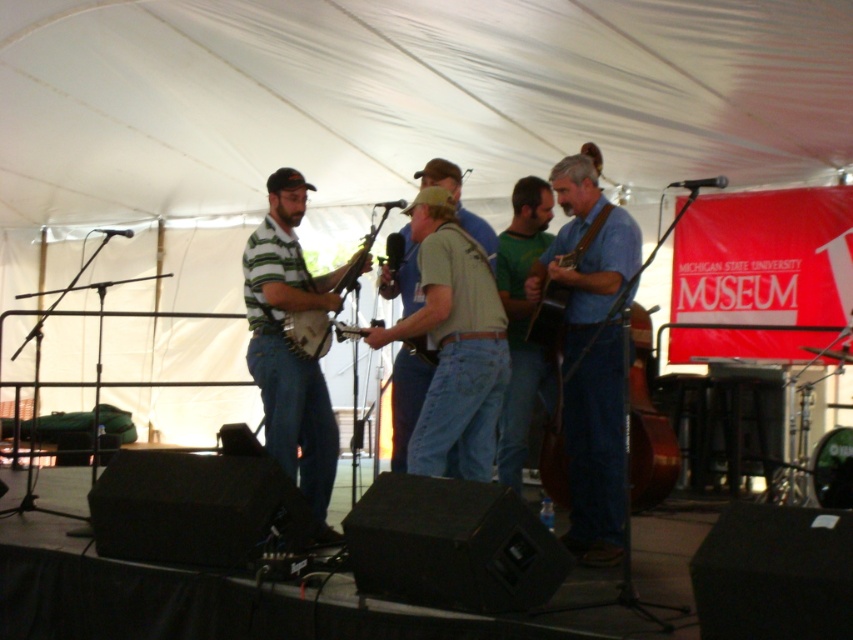
Question: Which object appears farthest from the camera in this image?

Choices:
 (A) striped jersey banjo at center
 (B) brown wooden cello at lower right
 (C) wooden banjo at center
 (D) blue denim jeans at center

Answer: (C)

Question: Which object is farther from the camera taking this photo?

Choices:
 (A) striped jersey banjo at center
 (B) brown wooden cello at lower right
 (C) wooden banjo at center

Answer: (C)

Question: Can you confirm if blue denim jeans at center is positioned above wooden banjo at center?

Choices:
 (A) yes
 (B) no

Answer: (B)

Question: Is blue denim jeans at center wider than wooden banjo at center?

Choices:
 (A) no
 (B) yes

Answer: (A)

Question: Is blue denim jeans at center closer to camera compared to striped jersey banjo at center?

Choices:
 (A) yes
 (B) no

Answer: (A)

Question: Which object is the farthest from the blue denim jeans at center?

Choices:
 (A) striped jersey banjo at center
 (B) brown wooden cello at lower right
 (C) wooden banjo at center

Answer: (A)